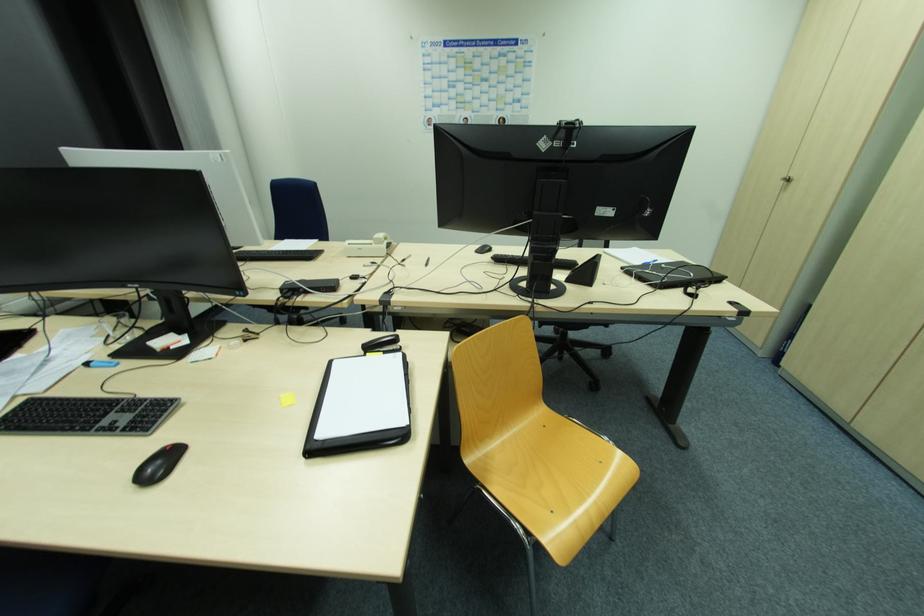
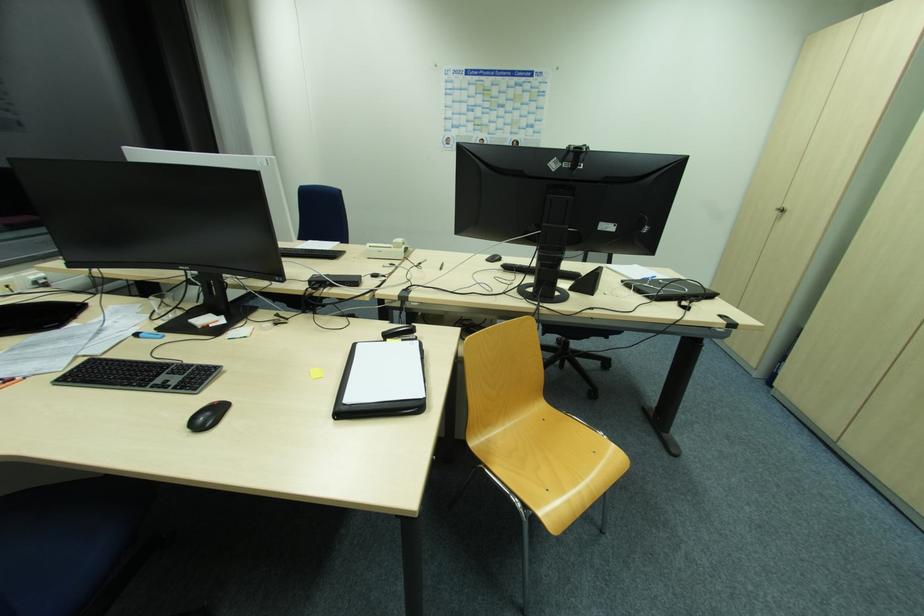
In the second image, find the point that corresponds to (x=373, y=245) in the first image.

(393, 249)